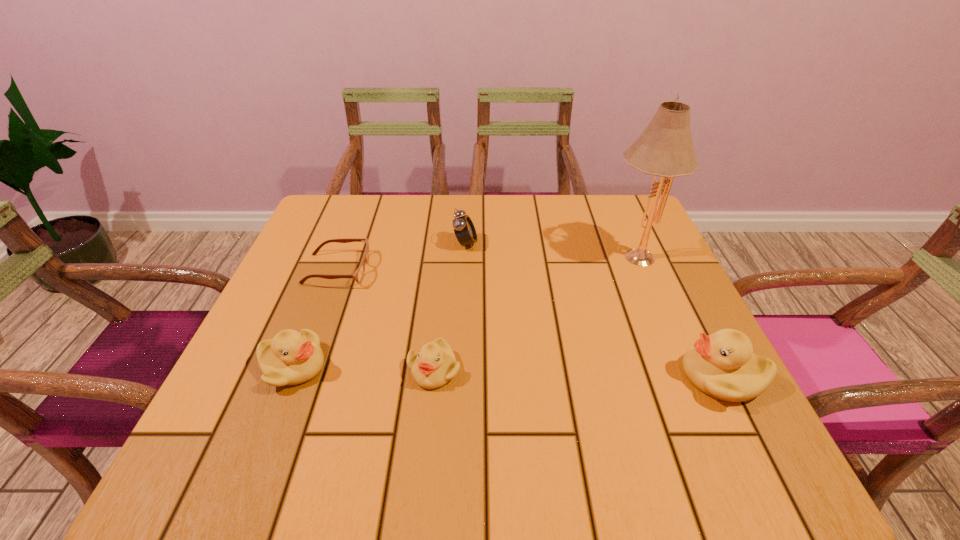
Locate an element on the screen. The image size is (960, 540). lampshade that is positioned at the right edge is located at coordinates (665, 148).

Locate an element on the screen. object that is at the near left corner is located at coordinates (291, 358).

At what (x,y) coordinates should I click in order to perform the action: click on object that is at the far right corner. Please return your answer as a coordinate pair (x, y). Image resolution: width=960 pixels, height=540 pixels. Looking at the image, I should click on (665, 148).

Where is `object positioned at the near right corner`? The height and width of the screenshot is (540, 960). object positioned at the near right corner is located at coordinates (722, 365).

The image size is (960, 540). In the image, there is a desktop. What are the coordinates of `vacant region at the far edge` in the screenshot? It's located at [525, 207].

The width and height of the screenshot is (960, 540). Find the location of `free point at the near edge`. free point at the near edge is located at coordinates (591, 383).

Find the location of `vacant space at the right edge of the desktop`. vacant space at the right edge of the desktop is located at coordinates (645, 280).

This screenshot has height=540, width=960. Find the location of `vacant space at the far left corner`. vacant space at the far left corner is located at coordinates (348, 230).

This screenshot has width=960, height=540. In the image, there is a desktop. In order to click on free region at the near left corner in this screenshot , I will do `click(232, 390)`.

This screenshot has height=540, width=960. What are the coordinates of `free space at the far right corner of the desktop` in the screenshot? It's located at (642, 238).